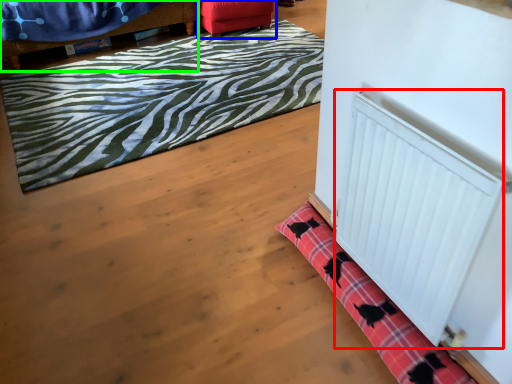
Question: Based on their relative distances, which object is farther from radiator (highlighted by a red box)? Choose from furniture (highlighted by a blue box) and furniture (highlighted by a green box).

Choices:
 (A) furniture
 (B) furniture

Answer: (B)